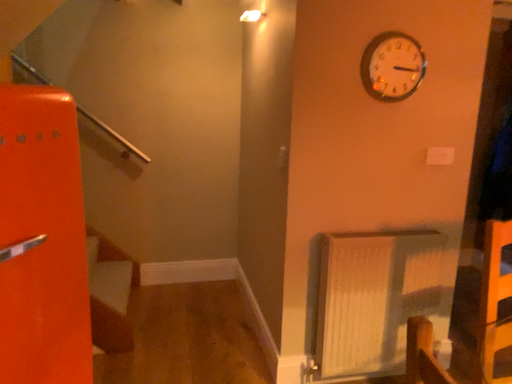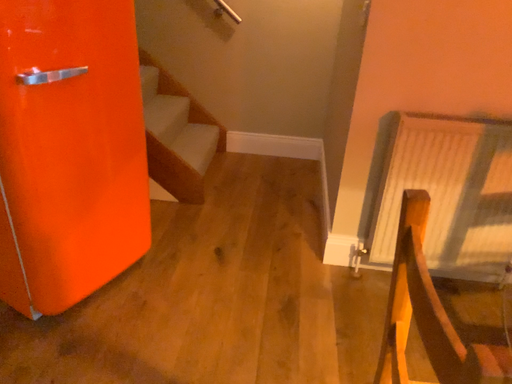
Question: Which way did the camera rotate in the video?

Choices:
 (A) rotated left
 (B) rotated right

Answer: (A)